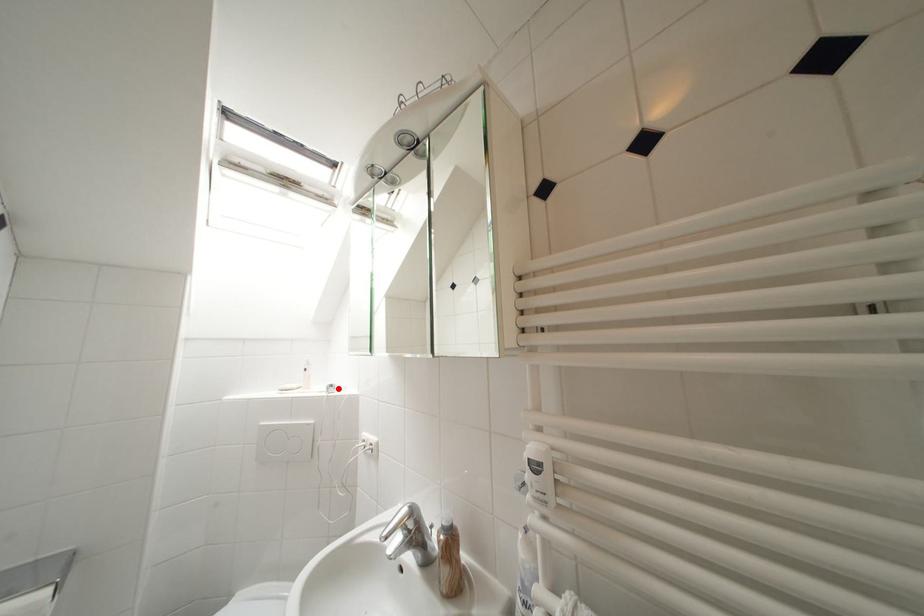
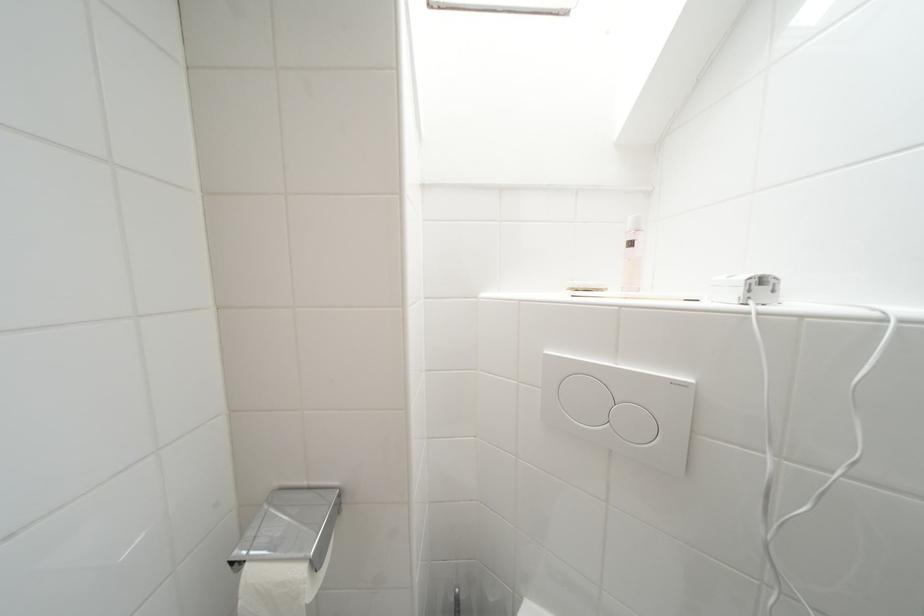
In the second image, find the point that corresponds to the highlighted location in the first image.

(769, 283)